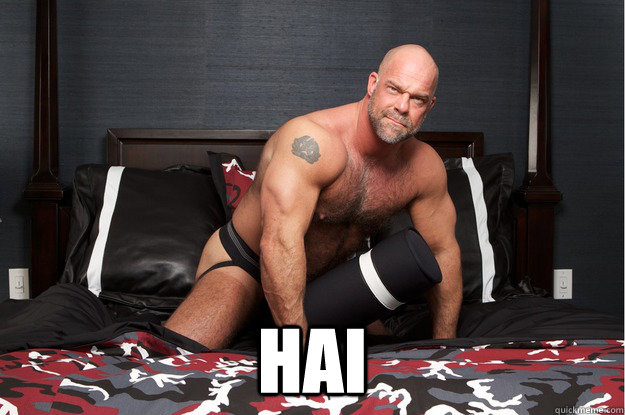
Find the location of a particular element. The image size is (625, 415). left bedpost is located at coordinates (41, 71).